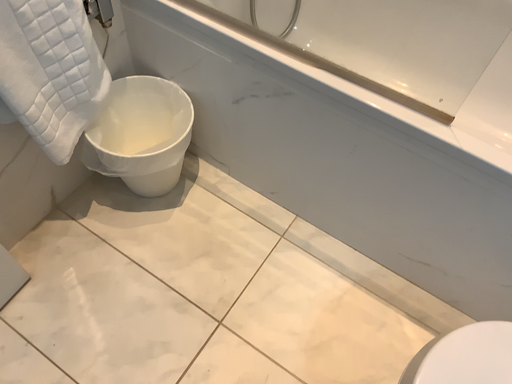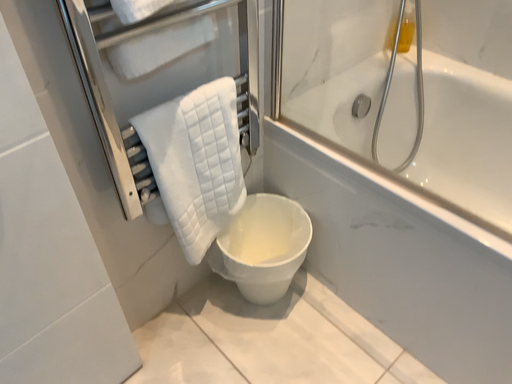
Question: Which way did the camera rotate in the video?

Choices:
 (A) rotated left
 (B) rotated right

Answer: (A)